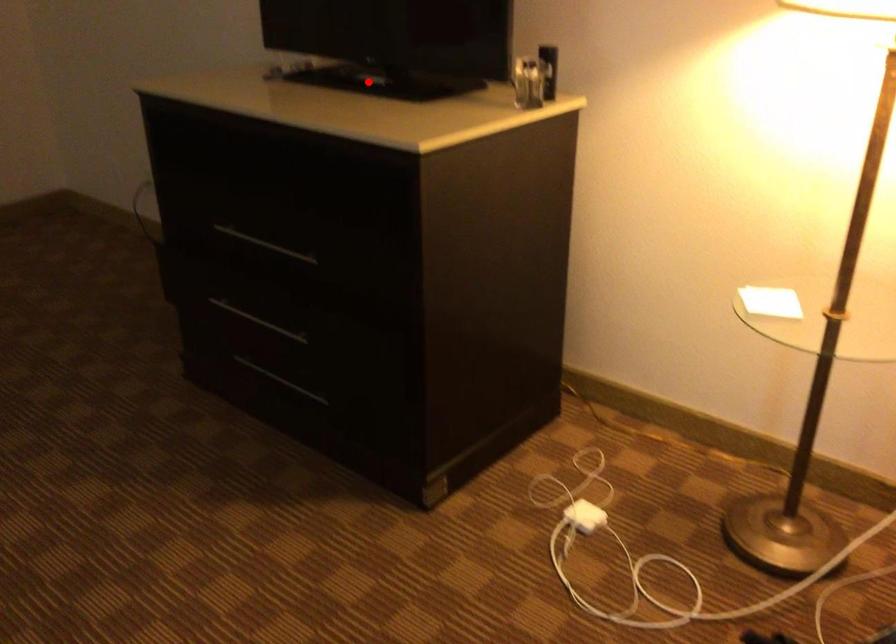
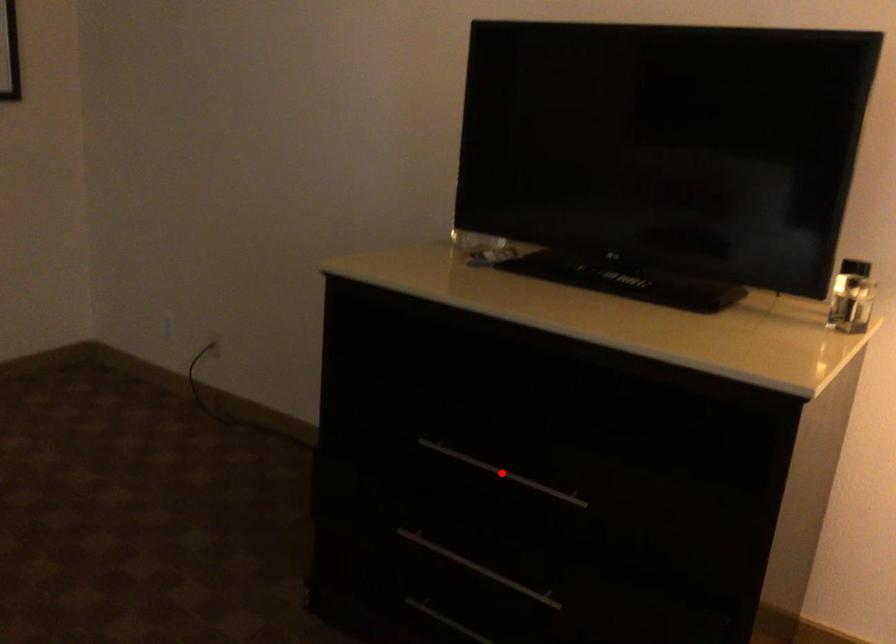
I am providing you with two images of the same scene from different viewpoints. A red point is marked on the first image and another point is marked on the second image. Does the point marked in image1 correspond to the same location as the one in image2?

No